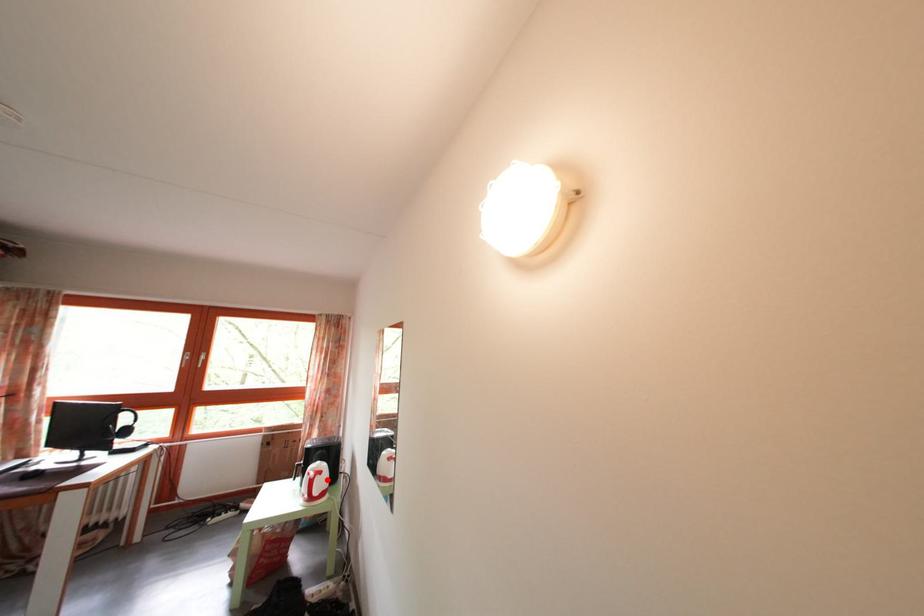
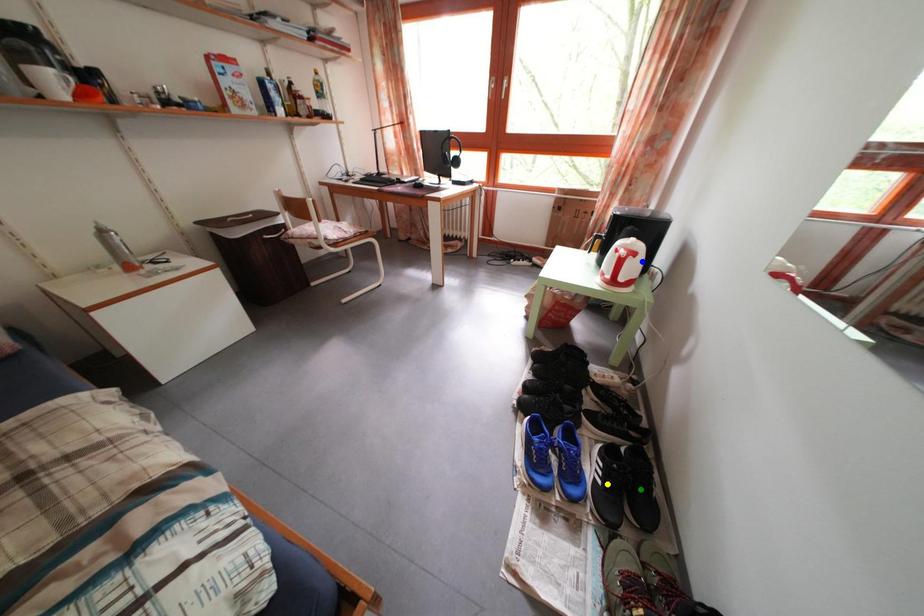
Question: I am providing you with two images of the same scene from different viewpoints. A red point is marked on the first image. You are given multiple points on the second image. Which spot in image 2 lines up with the point in image 1?

Choices:
 (A) green point
 (B) yellow point
 (C) blue point

Answer: (C)